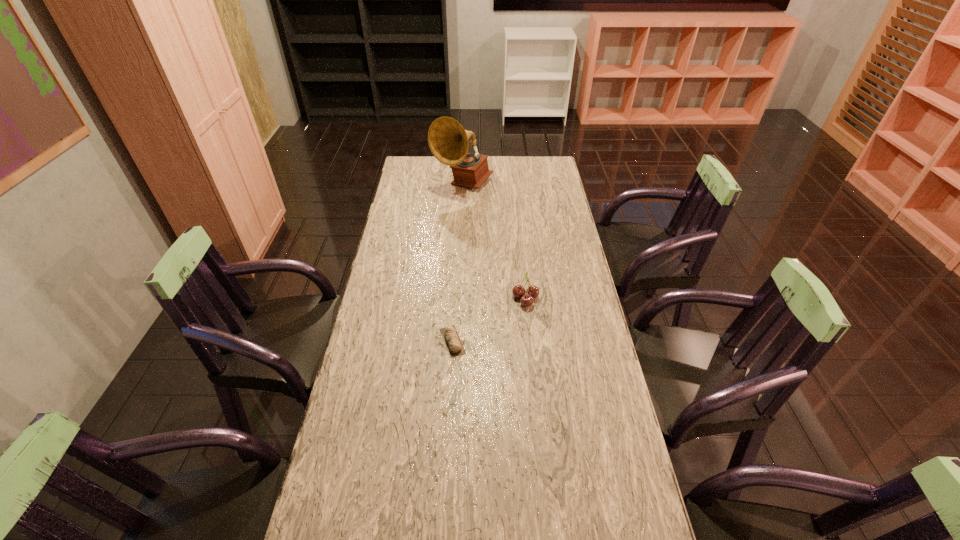
This screenshot has height=540, width=960. Identify the location of vacant space that satisfies the following two spatial constraints: 1. on the leaves of the cherry; 2. on the front side of the shortest object. (530, 341).